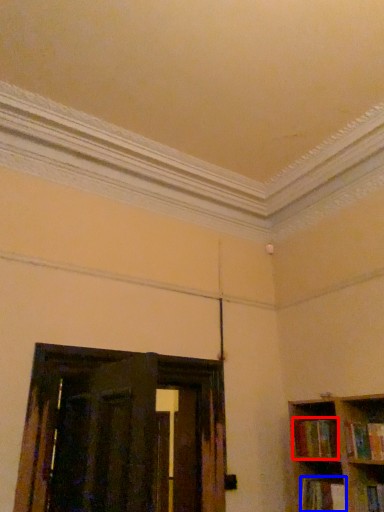
Question: Which point is closer to the camera, book (highlighted by a red box) or book (highlighted by a blue box)?

Choices:
 (A) book
 (B) book

Answer: (B)